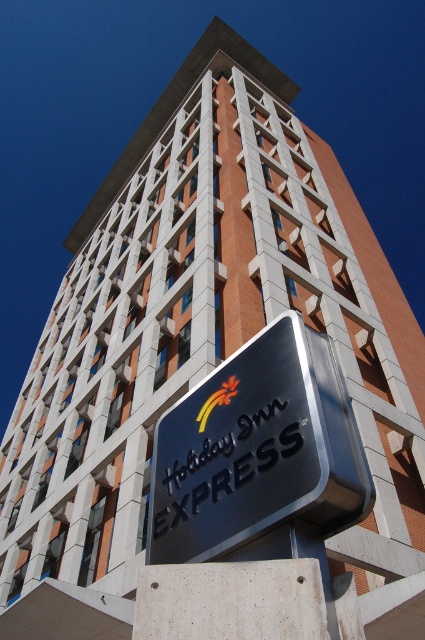
You are standing in front of the Holiday Inn Express sign. You notice two points marked on the building facade. The first point is at coordinate (241, 458) and the second is at (207, 413). Which point is closer to your current position?

Point (241, 458) is closer to the camera than point (207, 413), so the first point is closer to your current position.

What is located at the coordinates point [260,456]?

The metallic silver sign at center is located at point [260,456].